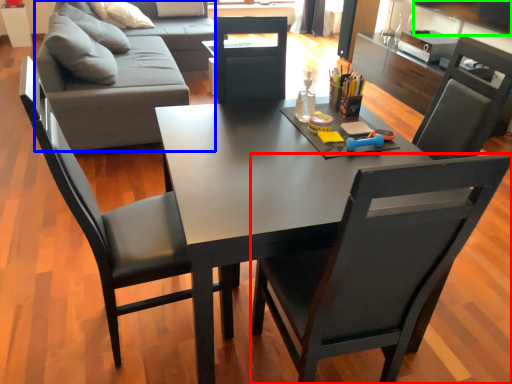
Question: Estimate the real-world distances between objects in this image. Which object is farther from chair (highlighted by a red box), studio couch (highlighted by a blue box) or television (highlighted by a green box)?

Choices:
 (A) studio couch
 (B) television

Answer: (B)